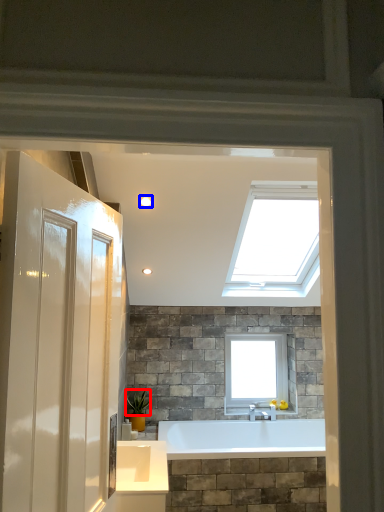
Question: Among these objects, which one is nearest to the camera, plant (highlighted by a red box) or lighting (highlighted by a blue box)?

Choices:
 (A) plant
 (B) lighting

Answer: (B)